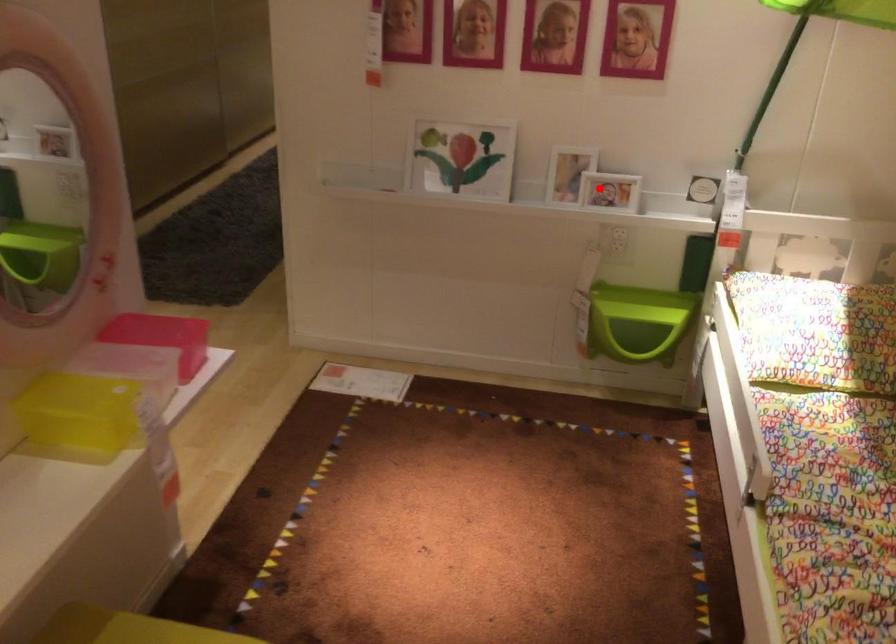
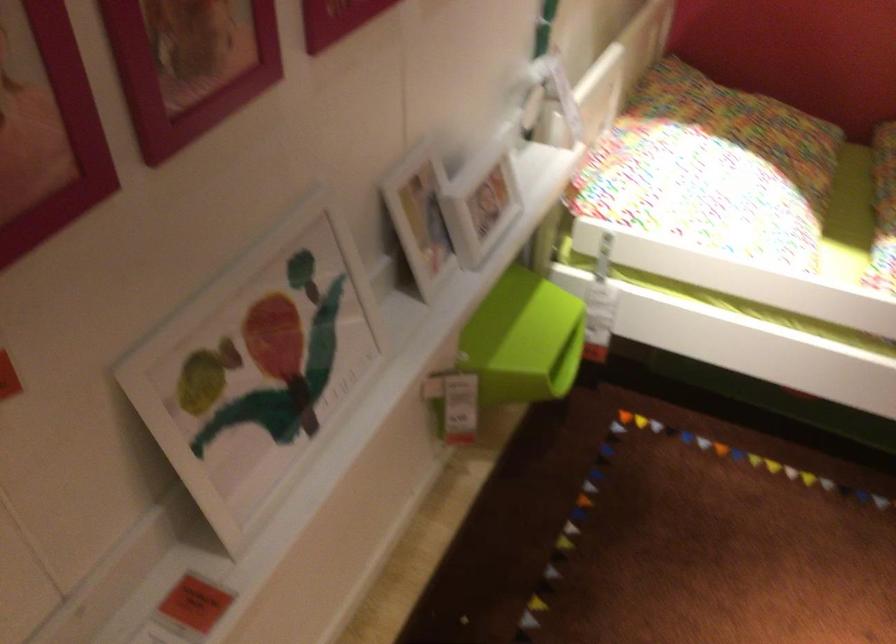
Question: I am providing you with two images of the same scene from different viewpoints. In image1, a red point is highlighted. Considering the same 3D point in image2, which of the following is correct?

Choices:
 (A) It is closer
 (B) It is farther

Answer: (A)